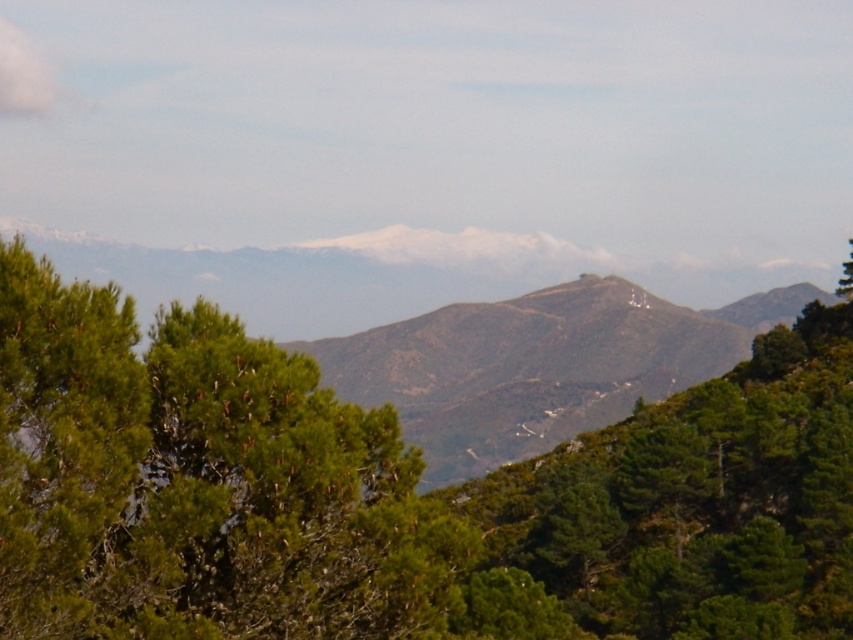
Question: Which point appears farthest from the camera in this image?

Choices:
 (A) (21, 32)
 (B) (508, 538)
 (C) (838, 282)

Answer: (A)

Question: Which object is positioned closest to the white fluffy cloud at upper left?

Choices:
 (A) green leafy tree at upper right
 (B) green leafy tree at center

Answer: (B)

Question: In this image, where is white fluffy cloud at upper left located relative to green leafy tree at upper right?

Choices:
 (A) left
 (B) right

Answer: (A)

Question: Which point is closer to the camera?

Choices:
 (A) (28, 49)
 (B) (468, 563)

Answer: (B)

Question: Is white fluffy cloud at upper left above green leafy tree at upper right?

Choices:
 (A) yes
 (B) no

Answer: (A)

Question: Does green leafy tree at center appear on the right side of green leafy tree at upper right?

Choices:
 (A) no
 (B) yes

Answer: (A)